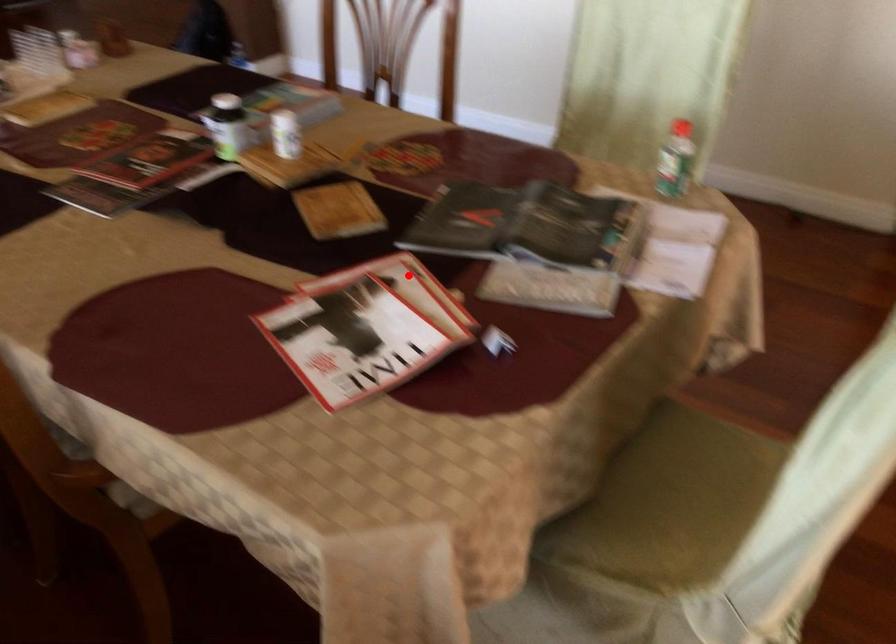
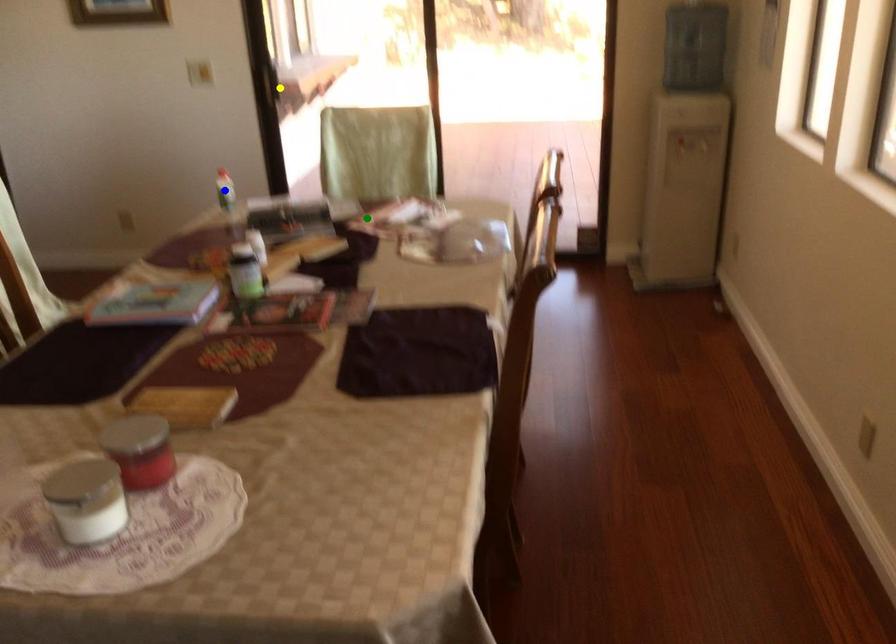
Question: I am providing you with two images of the same scene from different viewpoints. A red point is marked on the first image. You are given multiple points on the second image. Which mark in image 2 goes with the point in image 1?

Choices:
 (A) green point
 (B) blue point
 (C) yellow point

Answer: (A)